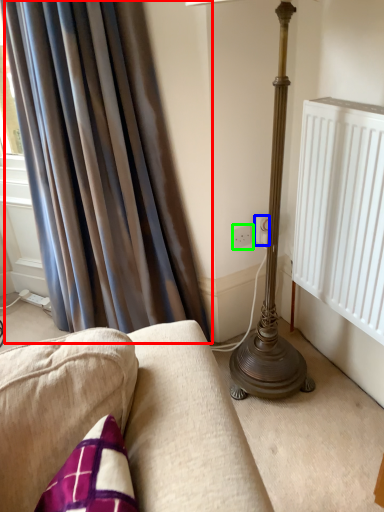
Question: Considering the real-world distances, which object is closest to curtain (highlighted by a red box)? electric outlet (highlighted by a blue box) or electric outlet (highlighted by a green box).

Choices:
 (A) electric outlet
 (B) electric outlet

Answer: (B)